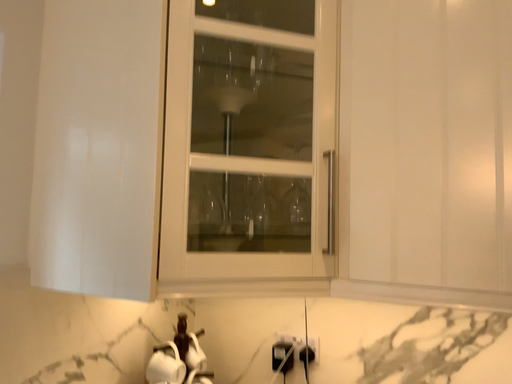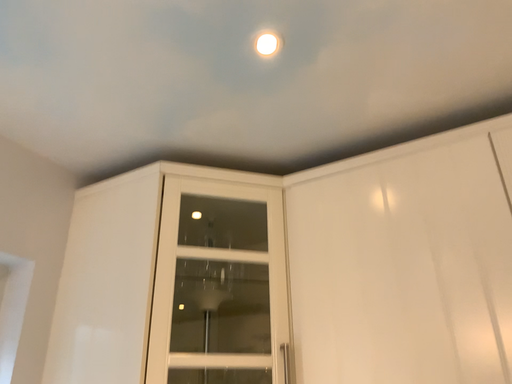
Question: How did the camera likely rotate when shooting the video?

Choices:
 (A) rotated upward
 (B) rotated downward

Answer: (A)